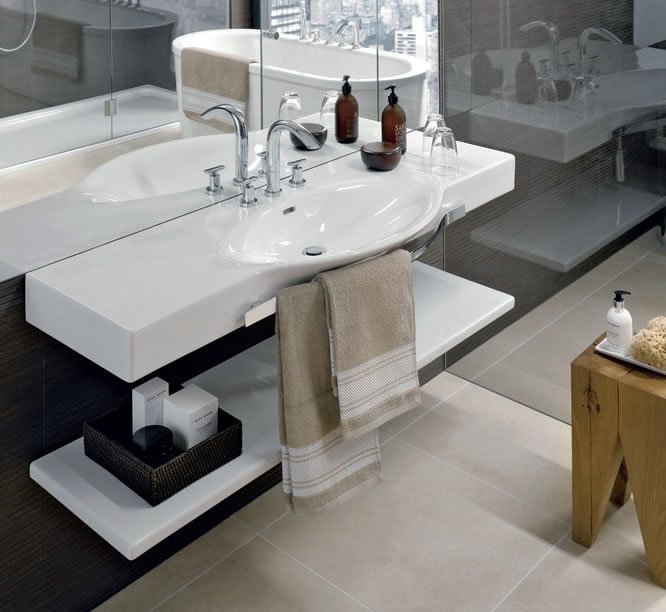
The height and width of the screenshot is (612, 666). Find the location of `brown soap jar`. brown soap jar is located at coordinates (392, 124).